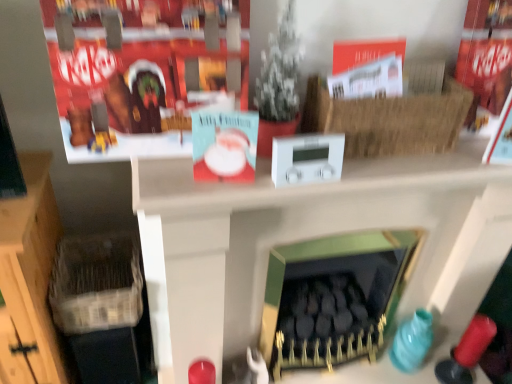
What is the approximate width of teal glossy vase at lower right?

4.99 inches.

Where is `green matte fireplace at center`? green matte fireplace at center is located at coordinates (313, 237).

What do you see at coordinates (30, 276) in the screenshot? This screenshot has height=384, width=512. I see `wooden crate at left` at bounding box center [30, 276].

The image size is (512, 384). Find the location of `green matte fireplace at center`. green matte fireplace at center is located at coordinates click(333, 298).

From a real-world perspective, is green matte fireplace at center positioned above or below red cardboard box at upper left?

green matte fireplace at center is below red cardboard box at upper left.

How many degrees apart are the facing directions of green matte fireplace at center and red cardboard box at upper left?

The angle between the facing direction of green matte fireplace at center and the facing direction of red cardboard box at upper left is 1.6 degrees.

From the image's perspective, relative to red cardboard box at upper left, is green matte fireplace at center above or below?

green matte fireplace at center is below red cardboard box at upper left.

Is green matte fireplace at center facing away from red cardboard box at upper left?

green matte fireplace at center is not turned away from red cardboard box at upper left.

Is green matte fireplace at center completely or partially outside of woven wicker basket at lower left, which is counted as the second basket, starting from the right?

Yes, green matte fireplace at center is located beyond the bounds of woven wicker basket at lower left, which is counted as the second basket, starting from the right.

From the image's perspective, does green matte fireplace at center appear lower than woven wicker basket at lower left, acting as the first basket starting from the left?

Correct, green matte fireplace at center appears lower than woven wicker basket at lower left, acting as the first basket starting from the left, in the image.

Between green matte fireplace at center and woven wicker basket at lower left, acting as the first basket starting from the left, which one has larger width?

green matte fireplace at center is wider.

Consider the image. Would you say green matte fireplace at center is to the left or to the right of woven wicker basket at lower left, which is the first basket in back-to-front order, in the picture?

Clearly, green matte fireplace at center is on the right of woven wicker basket at lower left, which is the first basket in back-to-front order, in the image.

Considering the sizes of woven wicker basket at lower left, acting as the first basket starting from the left, and green matte fireplace at center in the image, is woven wicker basket at lower left, acting as the first basket starting from the left, wider or thinner than green matte fireplace at center?

In the image, woven wicker basket at lower left, acting as the first basket starting from the left, appears to be wider than green matte fireplace at center.

Considering the positions of points (79, 324) and (286, 200), is point (79, 324) farther from camera compared to point (286, 200)?

That is True.

From a real-world perspective, is woven wicker basket at lower left, the 2th basket viewed from the front, above or below green matte fireplace at center?

woven wicker basket at lower left, the 2th basket viewed from the front, is below green matte fireplace at center.

Is woven wicker basket at lower left, which is counted as the second basket, starting from the right, in front of or behind green matte fireplace at center in the image?

In the image, woven wicker basket at lower left, which is counted as the second basket, starting from the right, appears behind green matte fireplace at center.

Based on the photo, which object is closer to the camera, green matte fireplace at center or wooden crate at left?

wooden crate at left.

Consider the image. Can you confirm if green matte fireplace at center is wider than wooden crate at left?

In fact, green matte fireplace at center might be narrower than wooden crate at left.

Could you tell me if green matte fireplace at center is turned towards wooden crate at left?

No, green matte fireplace at center is not oriented towards wooden crate at left.

From a real-world perspective, is green matte fireplace at center physically located above or below wooden crate at left?

green matte fireplace at center is above wooden crate at left.

Could you tell me if braided straw basket at upper right, the second basket viewed from the back, is facing woven wicker basket at lower left, the 2th basket viewed from the front?

No, braided straw basket at upper right, the second basket viewed from the back, does not turn towards woven wicker basket at lower left, the 2th basket viewed from the front.

Is braided straw basket at upper right, which is the first basket from right to left, bigger than woven wicker basket at lower left, which is the 2th basket from top to bottom?

Actually, braided straw basket at upper right, which is the first basket from right to left, might be smaller than woven wicker basket at lower left, which is the 2th basket from top to bottom.

From a real-world perspective, is braided straw basket at upper right, the 2th basket positioned from the bottom, positioned under woven wicker basket at lower left, which is the first basket in back-to-front order, based on gravity?

No, from a real-world perspective, braided straw basket at upper right, the 2th basket positioned from the bottom, is not beneath woven wicker basket at lower left, which is the first basket in back-to-front order.

Does red cardboard box at upper left have a larger size compared to braided straw basket at upper right, the 2th basket positioned from the bottom?

Correct, red cardboard box at upper left is larger in size than braided straw basket at upper right, the 2th basket positioned from the bottom.

Is red cardboard box at upper left facing away from braided straw basket at upper right, the 1th basket from the front?

No, red cardboard box at upper left's orientation is not away from braided straw basket at upper right, the 1th basket from the front.

Between red cardboard box at upper left and braided straw basket at upper right, the 2th basket positioned from the bottom, which one is positioned behind?

braided straw basket at upper right, the 2th basket positioned from the bottom, is further from the camera.

Is red cardboard box at upper left located outside braided straw basket at upper right, the 1th basket from the front?

That's correct, red cardboard box at upper left is outside of braided straw basket at upper right, the 1th basket from the front.

From a real-world perspective, does braided straw basket at upper right, the 2th basket positioned from the bottom, sit lower than red cardboard box at upper left?

Yes, from a real-world perspective, braided straw basket at upper right, the 2th basket positioned from the bottom, is beneath red cardboard box at upper left.

Between braided straw basket at upper right, the 1th basket from the front, and red cardboard box at upper left, which one has larger width?

With larger width is braided straw basket at upper right, the 1th basket from the front.

The height and width of the screenshot is (384, 512). Identify the location of the 1st basket located beneath the red cardboard box at upper left (from a real-world perspective). (390, 120).

Can you see braided straw basket at upper right, which is counted as the 1th basket, starting from the top, touching red cardboard box at upper left?

No, braided straw basket at upper right, which is counted as the 1th basket, starting from the top, is not making contact with red cardboard box at upper left.

Locate an element on the screen. Image resolution: width=512 pixels, height=384 pixels. shelf in front of the green matte fireplace at center is located at coordinates (142, 71).

This screenshot has height=384, width=512. I want to click on fireplace below the woven wicker basket at lower left, which is the first basket in back-to-front order (from a real-world perspective), so click(x=333, y=298).

Considering their positions, is green matte fireplace at center positioned closer to green matte fireplace at center than wooden crate at left?

green matte fireplace at center is positioned closer to the anchor green matte fireplace at center.

Which object lies further to the anchor point green matte fireplace at center, green matte fireplace at center or white plastic thermostat at center?

Among the two, white plastic thermostat at center is located further to green matte fireplace at center.

When comparing their distances from wooden crate at left, does red cardboard box at upper left or white plastic thermostat at center seem closer?

Among the two, red cardboard box at upper left is located nearer to wooden crate at left.

Considering their positions, is green matte fireplace at center positioned further to teal glossy vase at lower right than wooden crate at left?

wooden crate at left is further to teal glossy vase at lower right.

Estimate the real-world distances between objects in this image. Which object is further from green matte fireplace at center, wooden crate at left or teal glossy vase at lower right?

Among the two, wooden crate at left is located further to green matte fireplace at center.

Looking at the image, which one is located closer to wooden crate at left, teal glossy vase at lower right or woven wicker basket at lower left, acting as the first basket starting from the left?

Among the two, woven wicker basket at lower left, acting as the first basket starting from the left, is located nearer to wooden crate at left.

From the image, which object appears to be farther from white plastic thermostat at center, woven wicker basket at lower left, the 1th basket from the bottom, or green matte fireplace at center?

woven wicker basket at lower left, the 1th basket from the bottom, is positioned further to the anchor white plastic thermostat at center.

Based on the photo, based on their spatial positions, is woven wicker basket at lower left, which is counted as the second basket, starting from the right, or green matte fireplace at center further from green matte fireplace at center?

woven wicker basket at lower left, which is counted as the second basket, starting from the right, lies further to green matte fireplace at center than the other object.

Where is `table located between woven wicker basket at lower left, the 1th basket from the bottom, and teal glossy vase at lower right in the left-right direction`? The image size is (512, 384). table located between woven wicker basket at lower left, the 1th basket from the bottom, and teal glossy vase at lower right in the left-right direction is located at coordinates (313, 237).

Where is `shelf between wooden crate at left and teal glossy vase at lower right`? This screenshot has width=512, height=384. shelf between wooden crate at left and teal glossy vase at lower right is located at coordinates (142, 71).

At what (x,y) coordinates should I click in order to perform the action: click on shelf situated between woven wicker basket at lower left, which is counted as the second basket, starting from the right, and white plastic thermostat at center from left to right. Please return your answer as a coordinate pair (x, y). This screenshot has height=384, width=512. Looking at the image, I should click on tap(142, 71).

Identify the location of appliance between wooden crate at left and green matte fireplace at center in the horizontal direction. (307, 159).